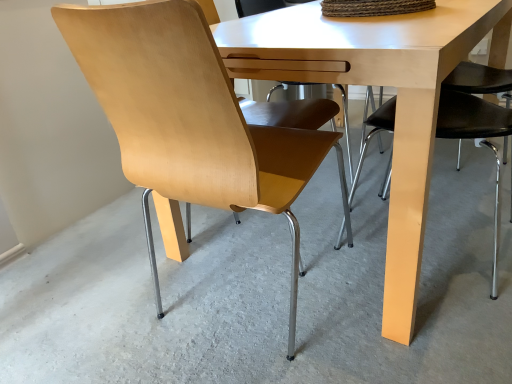
This screenshot has width=512, height=384. What do you see at coordinates (378, 84) in the screenshot? I see `light wood table at center` at bounding box center [378, 84].

Where is `light wood table at center`? Image resolution: width=512 pixels, height=384 pixels. light wood table at center is located at coordinates (378, 84).

The height and width of the screenshot is (384, 512). Describe the element at coordinates (189, 118) in the screenshot. I see `light brown wood chair at left` at that location.

Identify the location of light brown wood chair at left. (x=189, y=118).

The height and width of the screenshot is (384, 512). In order to click on light wood table at center in this screenshot , I will do `click(378, 84)`.

Based on the photo, between light brown wood chair at left and light wood table at center, which one appears on the right side from the viewer's perspective?

Positioned to the right is light wood table at center.

Is light brown wood chair at left positioned before light wood table at center?

Yes, light brown wood chair at left is closer to the camera.

Is point (143, 200) closer or farther from the camera than point (392, 237)?

Point (143, 200) is positioned farther from the camera compared to point (392, 237).

From the image's perspective, does light brown wood chair at left appear lower than light wood table at center?

Indeed, from the image's perspective, light brown wood chair at left is shown beneath light wood table at center.

From a real-world perspective, is light brown wood chair at left under light wood table at center?

No.

Which object is thinner, light brown wood chair at left or light wood table at center?

light brown wood chair at left.

Is light brown wood chair at left taller or shorter than light wood table at center?

In the image, light brown wood chair at left appears to be taller than light wood table at center.

Can you confirm if light brown wood chair at left is smaller than light wood table at center?

Correct, light brown wood chair at left occupies less space than light wood table at center.

Is light wood table at center located within light brown wood chair at left?

No.

Is there a large distance between light brown wood chair at left and light wood table at center?

They are positioned close to each other.

Is light wood table at center at the back of light brown wood chair at left?

No.

Can you tell me how much light brown wood chair at left and light wood table at center differ in facing direction?

They differ by 89.5 degrees in their facing directions.

Find the location of a particular element. This screenshot has width=512, height=384. table below the light brown wood chair at left (from a real-world perspective) is located at coordinates (378, 84).

Considering the relative positions of light wood table at center and light brown wood chair at left in the image provided, is light wood table at center to the left of light brown wood chair at left from the viewer's perspective?

No, light wood table at center is not to the left of light brown wood chair at left.

Is light wood table at center further to the viewer compared to light brown wood chair at left?

Yes, light wood table at center is behind light brown wood chair at left.

Is point (238, 49) closer or farther from the camera than point (152, 130)?

Point (238, 49).

From the image's perspective, which is above, light wood table at center or light brown wood chair at left?

light wood table at center is shown above in the image.

From a real-world perspective, is light wood table at center positioned above or below light brown wood chair at left?

In terms of real-world spatial position, light wood table at center is below light brown wood chair at left.

Considering the relative sizes of light wood table at center and light brown wood chair at left in the image provided, is light wood table at center wider than light brown wood chair at left?

Yes.

From their relative heights in the image, would you say light wood table at center is taller or shorter than light brown wood chair at left?

Clearly, light wood table at center is shorter compared to light brown wood chair at left.

Considering the sizes of objects light wood table at center and light brown wood chair at left in the image provided, who is bigger, light wood table at center or light brown wood chair at left?

With larger size is light wood table at center.

Is light wood table at center outside of light brown wood chair at left?

Yes, light wood table at center is outside of light brown wood chair at left.

Is light wood table at center in contact with light brown wood chair at left?

No, light wood table at center is not in contact with light brown wood chair at left.

Does light wood table at center turn towards light brown wood chair at left?

No, light wood table at center is not turned towards light brown wood chair at left.

What's the angular difference between light wood table at center and light brown wood chair at left's facing directions?

There is a 89.5-degree angle between the facing directions of light wood table at center and light brown wood chair at left.

How much distance is there between light wood table at center and light brown wood chair at left?

light wood table at center and light brown wood chair at left are 28.32 centimeters apart from each other.

Image resolution: width=512 pixels, height=384 pixels. Find the location of `table to the right of light brown wood chair at left`. table to the right of light brown wood chair at left is located at coordinates (378, 84).

In order to click on table to the right of light brown wood chair at left in this screenshot , I will do `click(378, 84)`.

Where is `chair that appears in front of the light wood table at center`? The height and width of the screenshot is (384, 512). chair that appears in front of the light wood table at center is located at coordinates (189, 118).